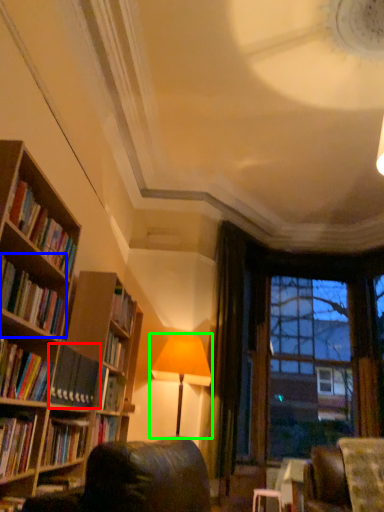
Question: Which is nearer to the book (highlighted by a red box)? book (highlighted by a blue box) or lamp (highlighted by a green box).

Choices:
 (A) book
 (B) lamp

Answer: (A)